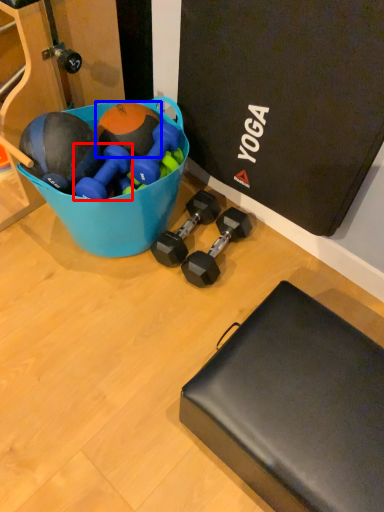
Question: Among these objects, which one is farthest to the camera, dumbbell (highlighted by a red box) or sports equipment (highlighted by a blue box)?

Choices:
 (A) dumbbell
 (B) sports equipment

Answer: (B)